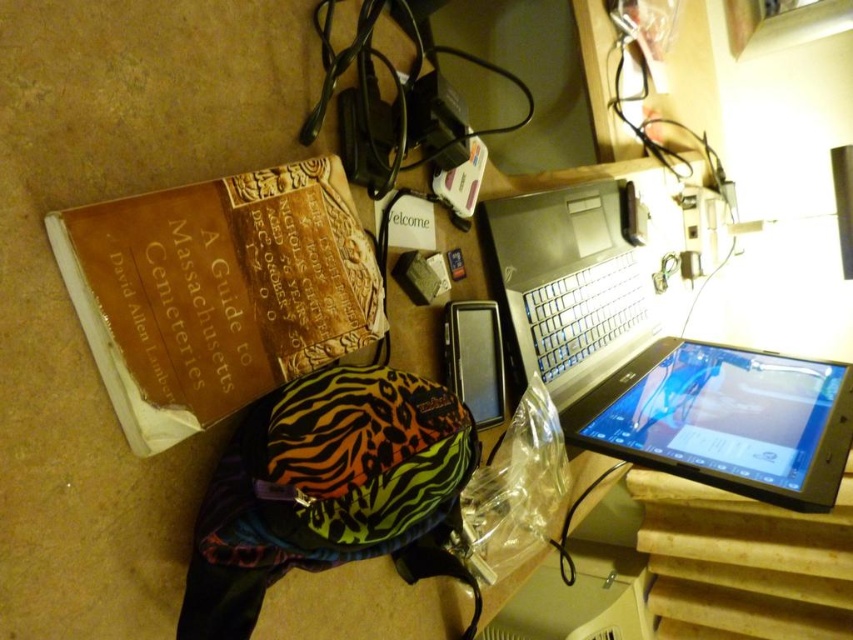
Who is higher up, matte black tablet at lower right or zebra-patterned fabric at center?

zebra-patterned fabric at center is above.

Is matte black tablet at lower right above zebra-patterned fabric at center?

Actually, matte black tablet at lower right is below zebra-patterned fabric at center.

This screenshot has height=640, width=853. I want to click on matte black tablet at lower right, so click(x=724, y=419).

Does black plastic keyboard at center-right have a lesser height compared to black matte tablet at center?

No, black plastic keyboard at center-right is not shorter than black matte tablet at center.

Is black plastic keyboard at center-right to the left of black matte tablet at center from the viewer's perspective?

No, black plastic keyboard at center-right is not to the left of black matte tablet at center.

Between point (639, 289) and point (457, 330), which one is positioned in front?

Positioned in front is point (457, 330).

Image resolution: width=853 pixels, height=640 pixels. Find the location of `black plastic keyboard at center-right`. black plastic keyboard at center-right is located at coordinates (584, 310).

Is matte black tablet at lower right behind black plastic keyboard at center-right?

No, it is not.

Identify the location of matte black tablet at lower right. The width and height of the screenshot is (853, 640). (724, 419).